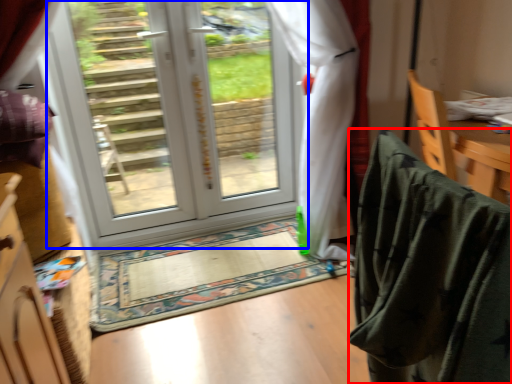
Question: Which object appears closest to the camera in this image, blanket (highlighted by a red box) or door (highlighted by a blue box)?

Choices:
 (A) blanket
 (B) door

Answer: (A)